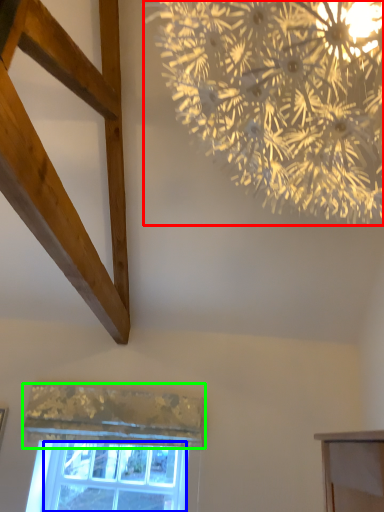
Question: Which object is positioned closest to flower (highlighted by a red box)? Select from window screen (highlighted by a blue box) and curtain (highlighted by a green box).

Choices:
 (A) window screen
 (B) curtain

Answer: (B)